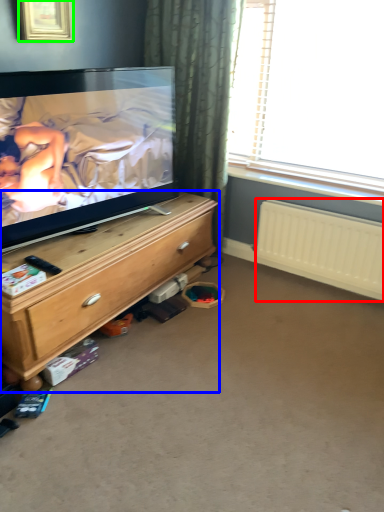
Question: Based on their relative distances, which object is nearer to radiator (highlighted by a red box)? Choose from chest of drawers (highlighted by a blue box) and picture frame (highlighted by a green box).

Choices:
 (A) chest of drawers
 (B) picture frame

Answer: (A)